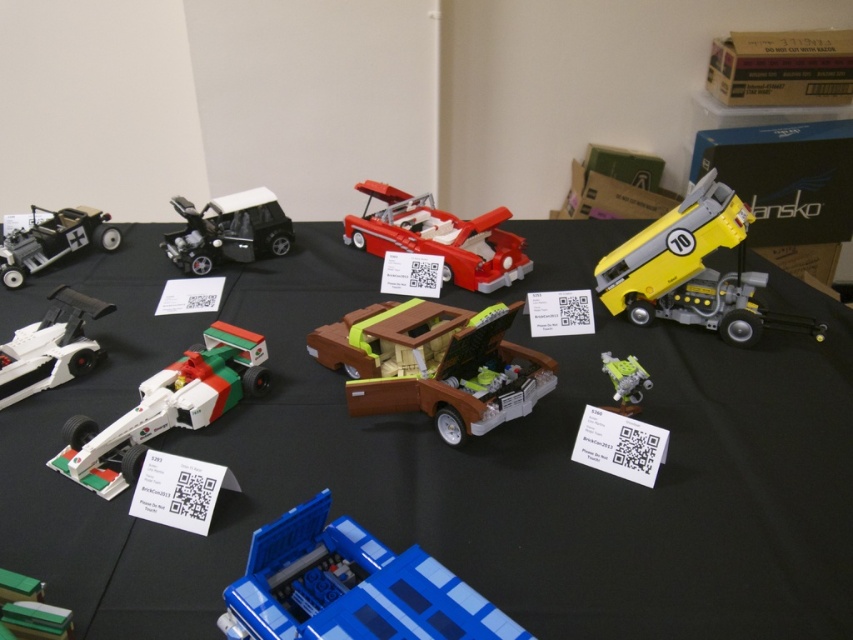
Question: Does black matte car at center appear over green plastic robot at lower right?

Choices:
 (A) no
 (B) yes

Answer: (B)

Question: Which object is the farthest from the white matte racing car at left?

Choices:
 (A) black plastic table at center
 (B) matte black car at left

Answer: (A)

Question: Can you confirm if brown matte car at center is thinner than green plastic robot at lower right?

Choices:
 (A) yes
 (B) no

Answer: (B)

Question: Which point is farther from the camera taking this photo?

Choices:
 (A) (54, 342)
 (B) (610, 374)
 (C) (78, 470)
 (D) (32, 225)

Answer: (D)

Question: Is black plastic table at center positioned behind shiny red car at center?

Choices:
 (A) no
 (B) yes

Answer: (A)

Question: Among these points, which one is nearest to the camera?

Choices:
 (A) (321, 552)
 (B) (21, 387)
 (C) (82, 483)
 (D) (207, 266)

Answer: (A)